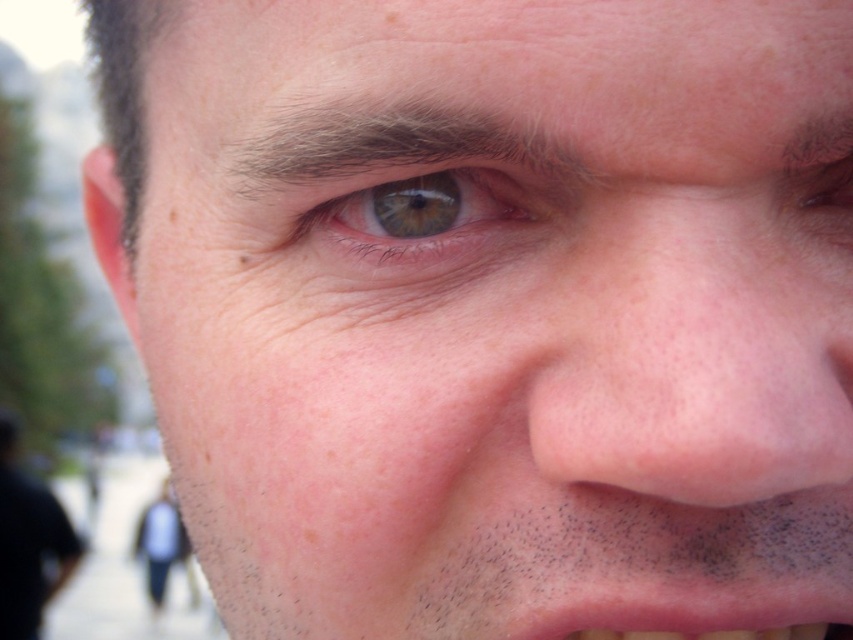
Question: Which is farther from the pink flesh-colored mouth at lower center?

Choices:
 (A) dry skin nose at center
 (B) green matte eye at upper center

Answer: (B)

Question: Where is dry skin nose at center located in relation to pink flesh-colored mouth at lower center in the image?

Choices:
 (A) right
 (B) left

Answer: (B)

Question: Which of the following is the farthest from the observer?

Choices:
 (A) (318, 220)
 (B) (778, 333)

Answer: (A)

Question: Can you confirm if green matte eye at upper center is positioned below pink flesh-colored mouth at lower center?

Choices:
 (A) no
 (B) yes

Answer: (A)

Question: Which of these objects is positioned closest to the green matte eye at upper center?

Choices:
 (A) pink flesh-colored mouth at lower center
 (B) dry skin nose at center

Answer: (B)

Question: Does dry skin nose at center appear over pink flesh-colored mouth at lower center?

Choices:
 (A) no
 (B) yes

Answer: (B)